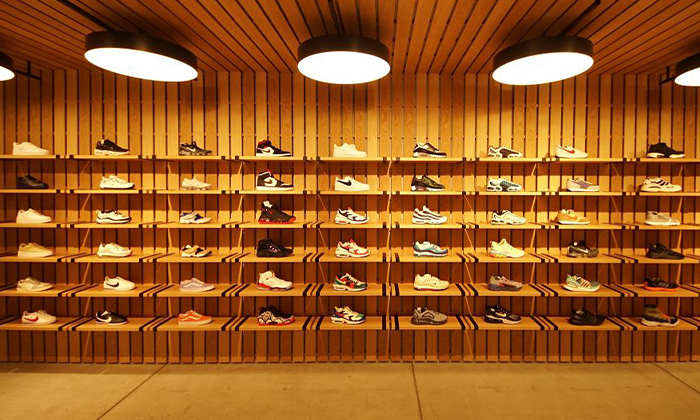
Image resolution: width=700 pixels, height=420 pixels. Identify the location of lights. (3, 77), (136, 70), (334, 60), (528, 64), (680, 76).